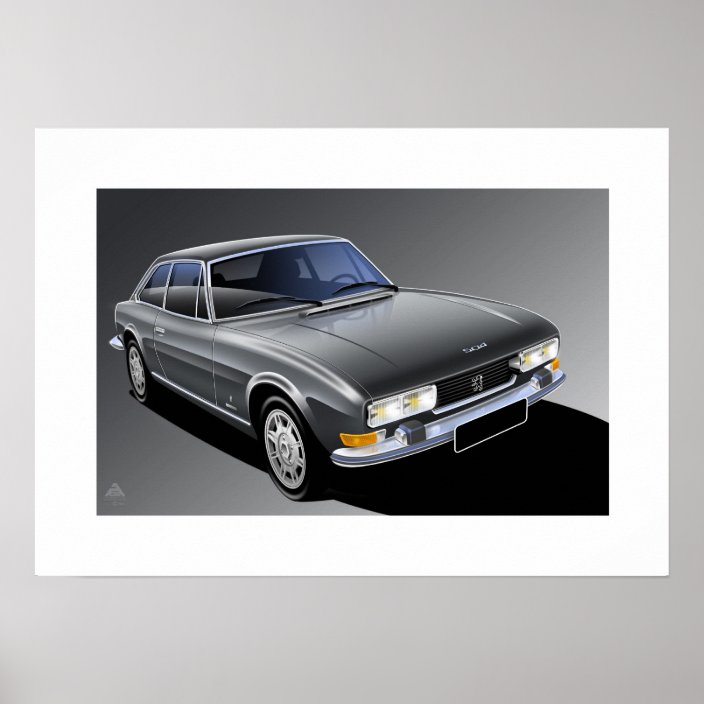
Where is `frame`? The image size is (704, 704). frame is located at coordinates (646, 431).